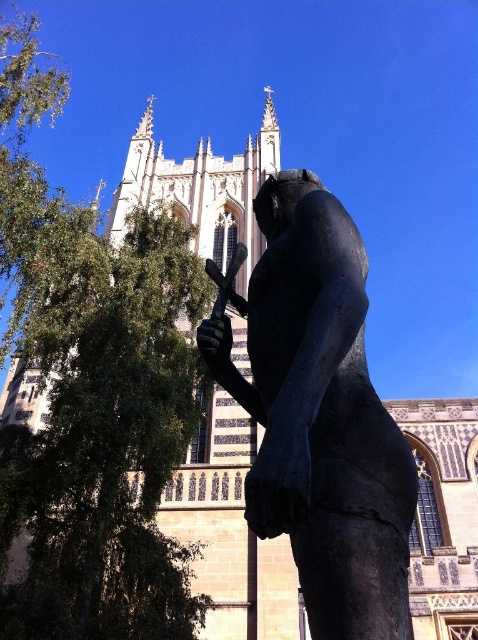
Who is more forward, (86,496) or (275,189)?

Point (275,189) is in front.

Is point (100, 260) positioned before point (284, 188)?

No, (100, 260) is behind (284, 188).

Where is `green leafy tree at left`? The height and width of the screenshot is (640, 478). green leafy tree at left is located at coordinates (108, 445).